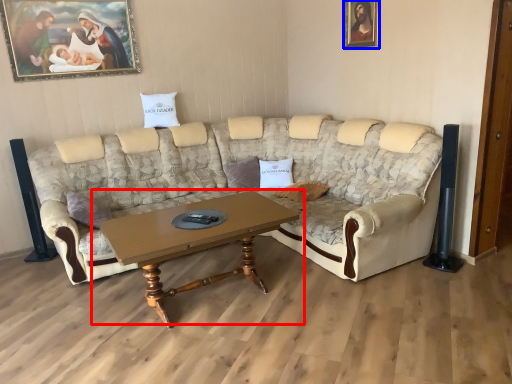
Question: Which of the following is the closest to the observer, coffee table (highlighted by a red box) or picture frame (highlighted by a blue box)?

Choices:
 (A) coffee table
 (B) picture frame

Answer: (A)